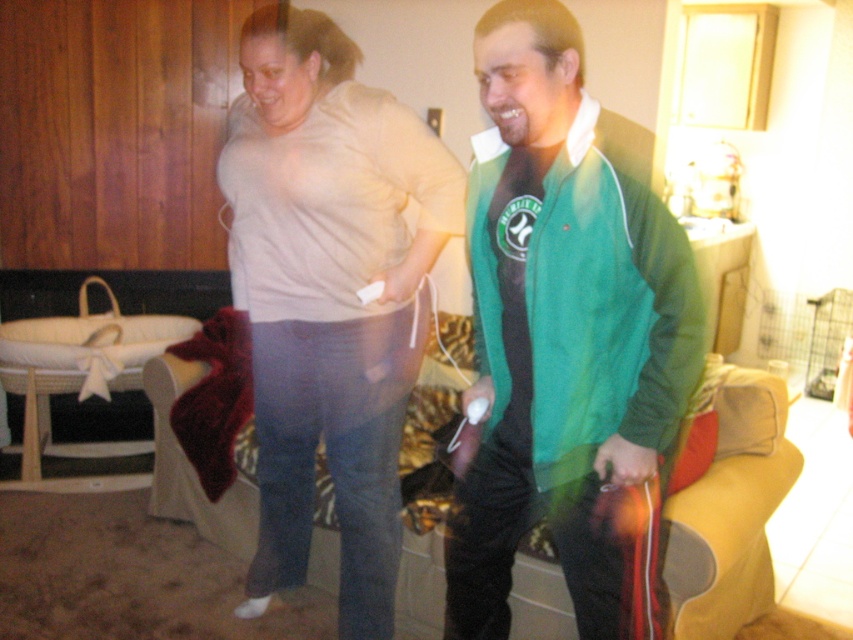
Question: Is green fleece jacket at center wider than matte beige shirt at center?

Choices:
 (A) yes
 (B) no

Answer: (B)

Question: In this image, where is green fleece jacket at center located relative to matte beige shirt at center?

Choices:
 (A) right
 (B) left

Answer: (A)

Question: Among these points, which one is nearest to the camera?

Choices:
 (A) (258, 604)
 (B) (496, 237)

Answer: (B)

Question: Which point is farther to the camera?

Choices:
 (A) (454, 196)
 (B) (500, 628)

Answer: (A)

Question: Can you confirm if green fleece jacket at center is positioned to the right of matte beige shirt at center?

Choices:
 (A) yes
 (B) no

Answer: (A)